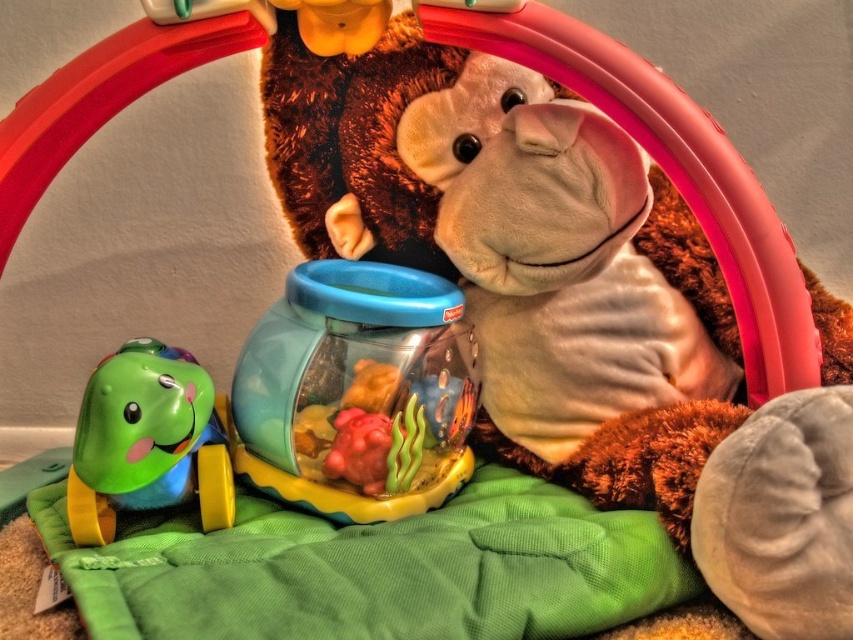
Between point (412, 28) and point (265, 456), which one is positioned behind?

The point (412, 28) is behind.

Between fuzzy brown teddy bear at center and translucent plastic toy at center, which one has less height?

Standing shorter between the two is translucent plastic toy at center.

Where is `fuzzy brown teddy bear at center`? The width and height of the screenshot is (853, 640). fuzzy brown teddy bear at center is located at coordinates (578, 310).

Can you confirm if fuzzy brown teddy bear at center is positioned below green rubber turtle at lower left?

No, fuzzy brown teddy bear at center is not below green rubber turtle at lower left.

Does fuzzy brown teddy bear at center appear over green rubber turtle at lower left?

Yes, fuzzy brown teddy bear at center is above green rubber turtle at lower left.

Where is `fuzzy brown teddy bear at center`? This screenshot has height=640, width=853. fuzzy brown teddy bear at center is located at coordinates (578, 310).

The height and width of the screenshot is (640, 853). I want to click on fuzzy brown teddy bear at center, so click(578, 310).

Is translucent plastic toy at center below green rubber turtle at lower left?

No, translucent plastic toy at center is not below green rubber turtle at lower left.

Does point (352, 428) lie in front of point (206, 516)?

No, it is behind (206, 516).

Locate an element on the screen. The width and height of the screenshot is (853, 640). translucent plastic toy at center is located at coordinates (357, 392).